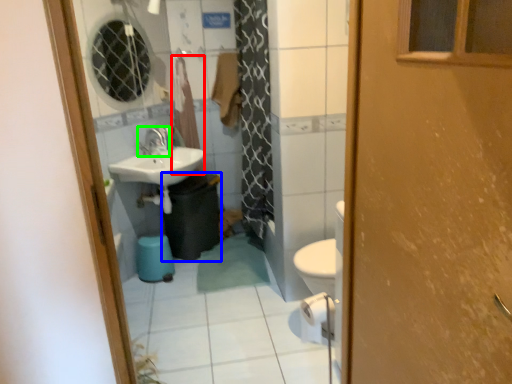
Question: Considering the real-world distances, which object is closest to curtain (highlighted by a red box)? garbage (highlighted by a blue box) or tap (highlighted by a green box).

Choices:
 (A) garbage
 (B) tap

Answer: (B)